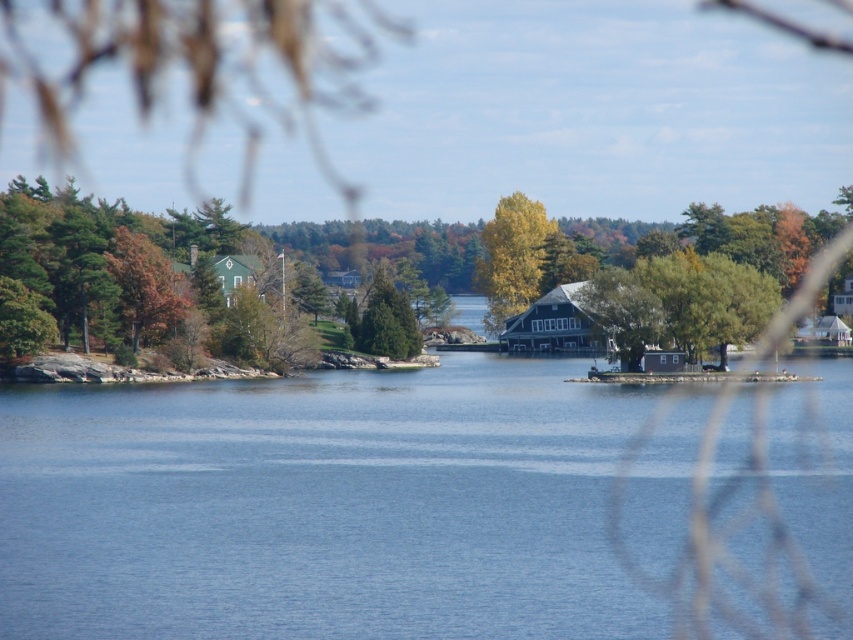
Between blue water at center and yellow-green foliage at center, which one has less height?

Standing shorter between the two is blue water at center.

Between blue water at center and yellow-green foliage at center, which one appears on the right side from the viewer's perspective?

Positioned to the right is yellow-green foliage at center.

The image size is (853, 640). Describe the element at coordinates (320, 506) in the screenshot. I see `blue water at center` at that location.

Identify the location of blue water at center. This screenshot has width=853, height=640. (320, 506).

Does green matte tree at left have a greater height compared to yellow-green foliage at center?

Indeed, green matte tree at left has a greater height compared to yellow-green foliage at center.

Is green matte tree at left to the right of yellow-green foliage at center from the viewer's perspective?

No, green matte tree at left is not to the right of yellow-green foliage at center.

Does point (206, 234) come farther from viewer compared to point (509, 262)?

No, (206, 234) is closer to viewer.

Locate an element on the screen. This screenshot has height=640, width=853. green matte tree at left is located at coordinates (672, 284).

Between blue water at center and green matte tree at left, which one appears on the left side from the viewer's perspective?

Positioned to the left is green matte tree at left.

Can you confirm if blue water at center is shorter than green matte tree at left?

Yes, blue water at center is shorter than green matte tree at left.

Is point (393, 445) positioned behind point (695, 224)?

No.

The image size is (853, 640). I want to click on blue water at center, so click(320, 506).